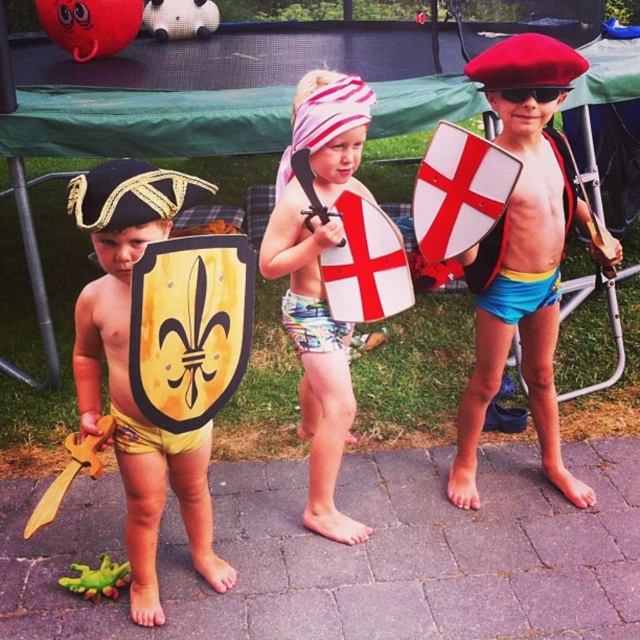
Does matte yellow shield at center have a lesser height compared to printed fabric diaper at center?

In fact, matte yellow shield at center may be taller than printed fabric diaper at center.

This screenshot has width=640, height=640. What do you see at coordinates (320, 278) in the screenshot?
I see `matte yellow shield at center` at bounding box center [320, 278].

Who is more distant from viewer, (323, 461) or (307, 310)?

Positioned behind is point (323, 461).

You are a GUI agent. You are given a task and a screenshot of the screen. Output one action in this format:
    pyautogui.click(x=<x>, y=<y>)
    Task: Click on the matte yellow shield at center
    The image size is (640, 640).
    Given the screenshot: What is the action you would take?
    pyautogui.click(x=320, y=278)

Is yellow fabric shield at left to the left of black plastic goggles at center from the viewer's perspective?

Correct, you'll find yellow fabric shield at left to the left of black plastic goggles at center.

Can you confirm if yellow fabric shield at left is shorter than black plastic goggles at center?

Incorrect, yellow fabric shield at left's height does not fall short of black plastic goggles at center's.

Locate an element on the screen. Image resolution: width=640 pixels, height=640 pixels. yellow fabric shield at left is located at coordinates (128, 371).

Is blue fabric diaper at center positioned behind printed fabric diaper at center?

Yes, blue fabric diaper at center is behind printed fabric diaper at center.

Find the location of a particular element. The width and height of the screenshot is (640, 640). blue fabric diaper at center is located at coordinates (518, 292).